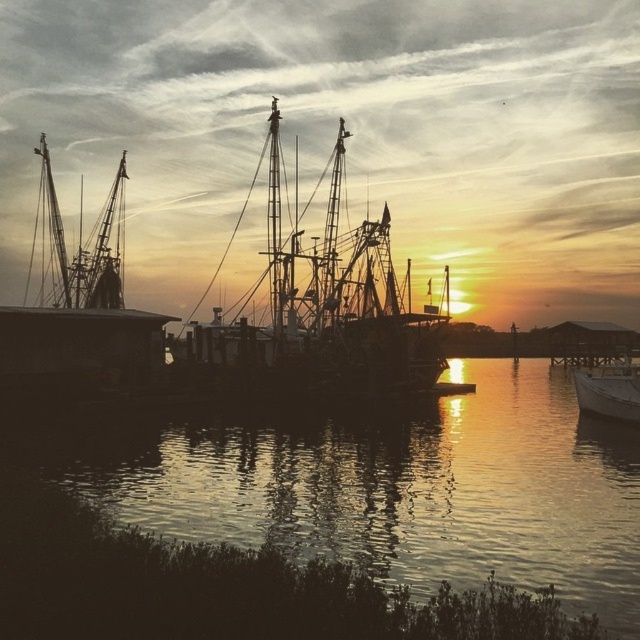
Question: Can you confirm if glistening water at center is positioned to the right of silhouette wooden boat at center?

Choices:
 (A) yes
 (B) no

Answer: (B)

Question: Among these points, which one is farthest from the camera?

Choices:
 (A) (289, 518)
 (B) (216, 362)

Answer: (B)

Question: Among these objects, which one is nearest to the camera?

Choices:
 (A) glistening water at center
 (B) silhouette wooden boat at center

Answer: (A)

Question: Considering the relative positions of glistening water at center and silhouette wooden boat at center in the image provided, where is glistening water at center located with respect to silhouette wooden boat at center?

Choices:
 (A) below
 (B) above

Answer: (A)

Question: Does silhouette wooden boat at center have a larger size compared to white matte boat at lower right?

Choices:
 (A) yes
 (B) no

Answer: (A)

Question: Among these objects, which one is farthest from the camera?

Choices:
 (A) glistening water at center
 (B) white matte boat at lower right
 (C) silhouette wooden boat at center

Answer: (C)